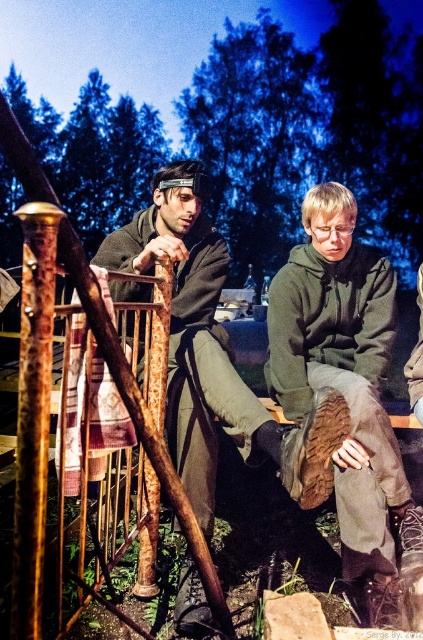
Measure the distance from green fuzzy hoodie at center to matte brown wooden stick at left.

They are 44.84 centimeters apart.

Which is in front, point (348, 394) or point (260, 428)?

Point (260, 428) is more forward.

Where is `green fuzzy hoodie at center`? This screenshot has height=640, width=423. green fuzzy hoodie at center is located at coordinates (348, 392).